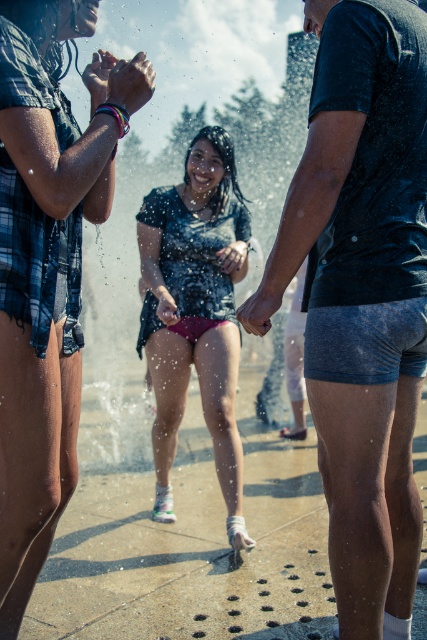
Based on the photo, does dark blue textured shorts at center have a larger size compared to matte black shorts at center?

Yes.

In the scene shown: Measure the distance from dark blue textured shorts at center to matte black shorts at center.

dark blue textured shorts at center is 32.08 inches from matte black shorts at center.

Is point (342, 564) farther from viewer compared to point (20, 304)?

Yes, point (342, 564) is behind point (20, 304).

The image size is (427, 640). Identify the location of dark blue textured shorts at center. (362, 296).

Who is positioned more to the right, matte black shorts at center or matte pink shorts at center?

Positioned to the right is matte pink shorts at center.

Find the location of a particular element. This screenshot has width=427, height=640. matte black shorts at center is located at coordinates (46, 272).

Between dark blue textured shorts at center and matte pink shorts at center, which one appears on the left side from the viewer's perspective?

From the viewer's perspective, matte pink shorts at center appears more on the left side.

Can you confirm if dark blue textured shorts at center is positioned to the left of matte pink shorts at center?

No, dark blue textured shorts at center is not to the left of matte pink shorts at center.

Measure the distance between dark blue textured shorts at center and camera.

A distance of 7.00 feet exists between dark blue textured shorts at center and camera.

Locate an element on the screen. This screenshot has width=427, height=640. dark blue textured shorts at center is located at coordinates (362, 296).